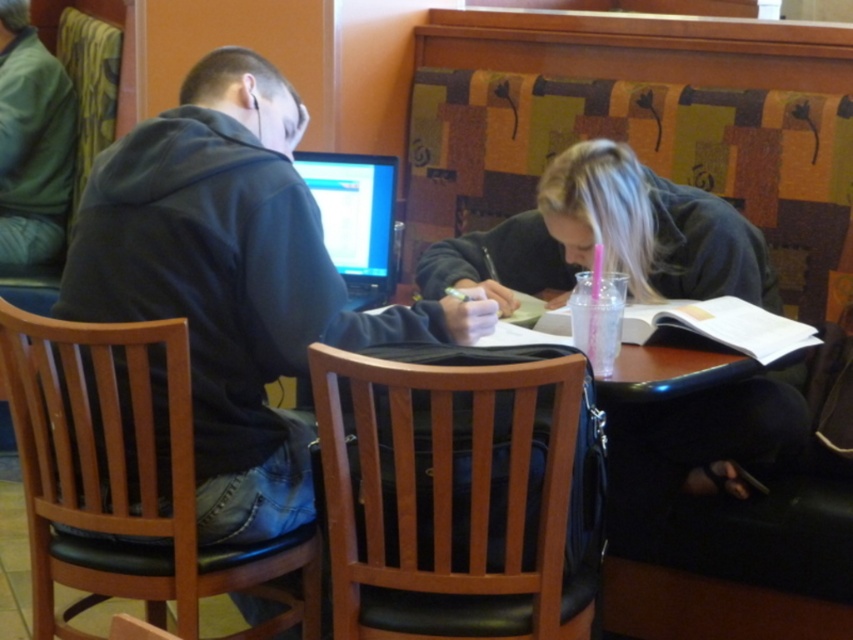
Question: Can you confirm if green fleece hoodie at left is positioned to the left of matte black laptop at center?

Choices:
 (A) no
 (B) yes

Answer: (B)

Question: Considering the real-world distances, which object is closest to the green fleece hoodie at left?

Choices:
 (A) dark gray hoodie at center
 (B) matte black laptop at center

Answer: (B)

Question: Which object is the farthest from the green fleece hoodie at left?

Choices:
 (A) dark gray hoodie at center
 (B) matte black laptop at center
 (C) dark blue hoodie at left

Answer: (A)

Question: Is dark blue hoodie at left bigger than green fleece hoodie at left?

Choices:
 (A) no
 (B) yes

Answer: (B)

Question: Does dark blue hoodie at left have a larger size compared to matte black laptop at center?

Choices:
 (A) yes
 (B) no

Answer: (A)

Question: Which of the following is the farthest from the observer?

Choices:
 (A) (27, 118)
 (B) (381, 157)

Answer: (A)